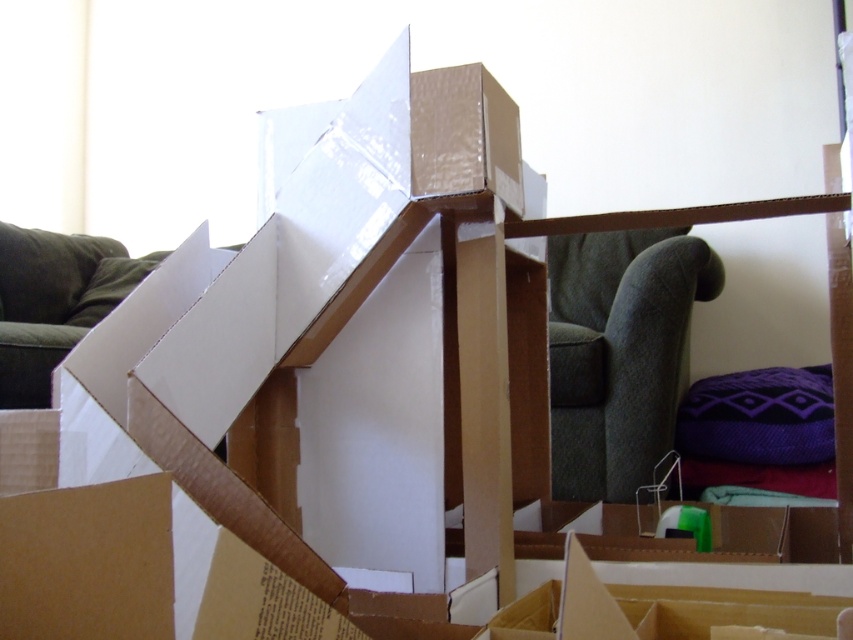
Question: Is dark green fabric armchair at center smaller than green fabric couch at left?

Choices:
 (A) no
 (B) yes

Answer: (A)

Question: Among these objects, which one is nearest to the camera?

Choices:
 (A) green fabric couch at left
 (B) dark green fabric armchair at center

Answer: (B)

Question: Is dark green fabric armchair at center further to camera compared to green fabric couch at left?

Choices:
 (A) no
 (B) yes

Answer: (A)

Question: Does dark green fabric armchair at center appear over green fabric couch at left?

Choices:
 (A) no
 (B) yes

Answer: (A)